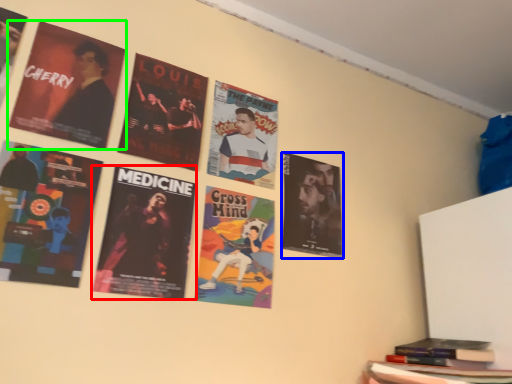
Question: Considering the real-world distances, which object is farthest from poster (highlighted by a red box)? poster (highlighted by a blue box) or poster (highlighted by a green box)?

Choices:
 (A) poster
 (B) poster

Answer: (A)